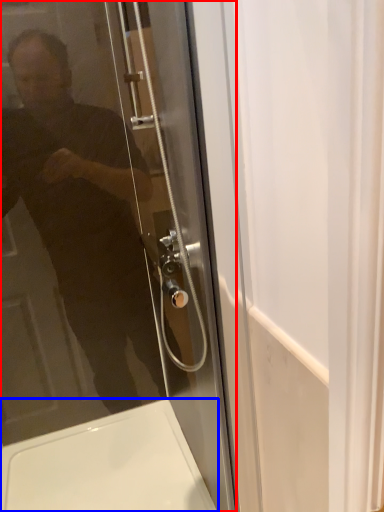
Question: Among these objects, which one is farthest to the camera, door (highlighted by a red box) or bath (highlighted by a blue box)?

Choices:
 (A) door
 (B) bath

Answer: (B)